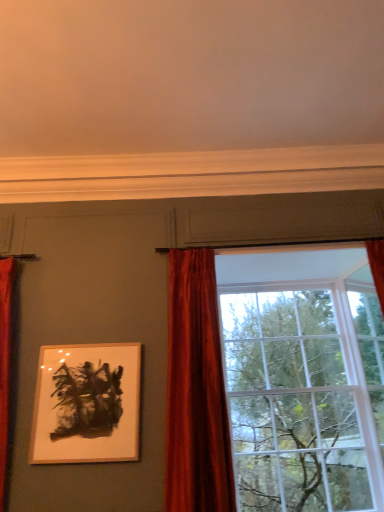
Question: Should I look upward or downward to see glass window at center?

Choices:
 (A) up
 (B) down

Answer: (B)

Question: Can you confirm if velvet red curtain at center is taller than wooden picture frame at upper left?

Choices:
 (A) no
 (B) yes

Answer: (B)

Question: Considering the relative positions of velvet red curtain at center and wooden picture frame at upper left in the image provided, is velvet red curtain at center to the left of wooden picture frame at upper left from the viewer's perspective?

Choices:
 (A) yes
 (B) no

Answer: (B)

Question: Does velvet red curtain at center have a greater width compared to wooden picture frame at upper left?

Choices:
 (A) no
 (B) yes

Answer: (B)

Question: Is velvet red curtain at center directly adjacent to wooden picture frame at upper left?

Choices:
 (A) no
 (B) yes

Answer: (A)

Question: Is velvet red curtain at center at the right side of wooden picture frame at upper left?

Choices:
 (A) yes
 (B) no

Answer: (A)

Question: Are velvet red curtain at center and wooden picture frame at upper left far apart?

Choices:
 (A) no
 (B) yes

Answer: (A)

Question: Can you confirm if velvet red curtain at center is thinner than glass window at center?

Choices:
 (A) no
 (B) yes

Answer: (B)

Question: Is velvet red curtain at center to the right of glass window at center from the viewer's perspective?

Choices:
 (A) no
 (B) yes

Answer: (A)

Question: Does velvet red curtain at center appear on the left side of glass window at center?

Choices:
 (A) no
 (B) yes

Answer: (B)

Question: From the image's perspective, is velvet red curtain at center located beneath glass window at center?

Choices:
 (A) no
 (B) yes

Answer: (A)

Question: Is velvet red curtain at center not near glass window at center?

Choices:
 (A) no
 (B) yes

Answer: (A)

Question: Is velvet red curtain at center placed right next to glass window at center?

Choices:
 (A) yes
 (B) no

Answer: (A)

Question: Can you confirm if glass window at center is thinner than velvet red curtain at center?

Choices:
 (A) no
 (B) yes

Answer: (A)